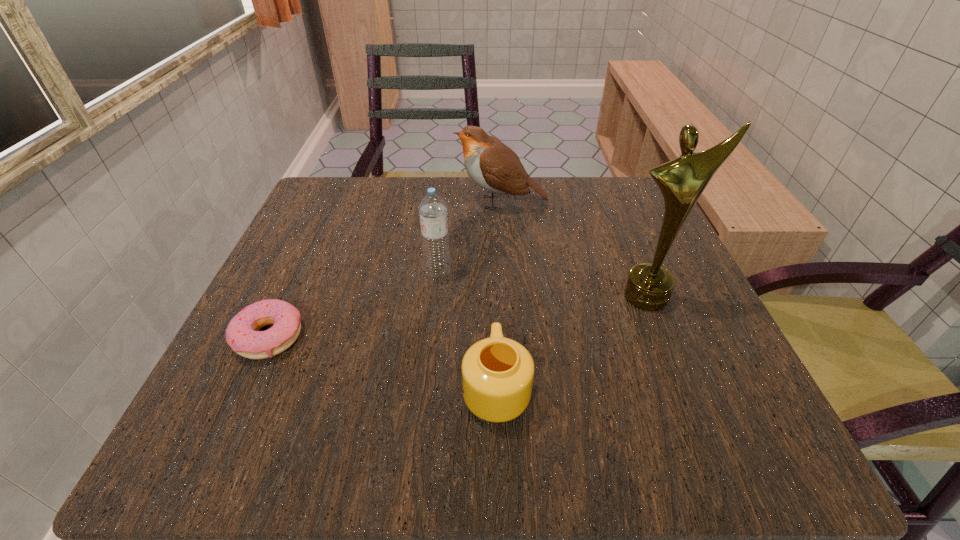
This screenshot has height=540, width=960. In the image, there is a desktop. Identify the location of vacant area at the far edge. (566, 216).

Find the location of a particular element. The width and height of the screenshot is (960, 540). free space at the near edge of the desktop is located at coordinates (x=491, y=426).

Identify the location of vacant space at the left edge of the desktop. This screenshot has width=960, height=540. (349, 257).

In order to click on vacant space at the right edge of the desktop in this screenshot , I will do click(684, 387).

The height and width of the screenshot is (540, 960). What are the coordinates of `vacant space at the far left corner of the desktop` in the screenshot? It's located at (326, 195).

The width and height of the screenshot is (960, 540). Find the location of `free space at the near left corner of the desktop`. free space at the near left corner of the desktop is located at coordinates (292, 429).

In the image, there is a desktop. Where is `blank space at the far right corner`? This screenshot has height=540, width=960. blank space at the far right corner is located at coordinates (636, 207).

You are a GUI agent. You are given a task and a screenshot of the screen. Output one action in this format:
    pyautogui.click(x=<x>, y=<y>)
    Task: Click on the blank region between the fourth tallest object and the water bottle
    This screenshot has height=540, width=960.
    Given the screenshot: What is the action you would take?
    pyautogui.click(x=468, y=329)

You are a GUI agent. You are given a task and a screenshot of the screen. Output one action in this format:
    pyautogui.click(x=<x>, y=<y>)
    Task: Click on the free spot between the mug and the water bottle
    The width and height of the screenshot is (960, 540).
    Given the screenshot: What is the action you would take?
    pyautogui.click(x=468, y=329)

The height and width of the screenshot is (540, 960). I want to click on free space between the water bottle and the leftmost object, so click(x=354, y=304).